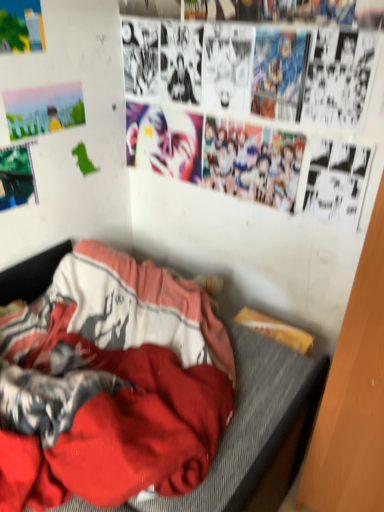
Question: From the image's perspective, is matte paper poster at upper left, the third poster page ordered from the bottom, positioned above or below watercolor paper poster at upper left, which is the second poster page in bottom-to-top order?

Choices:
 (A) below
 (B) above

Answer: (B)

Question: In terms of size, does matte paper poster at upper left, acting as the 1th poster page starting from the top, appear bigger or smaller than watercolor paper poster at upper left, which is the second poster page in bottom-to-top order?

Choices:
 (A) small
 (B) big

Answer: (B)

Question: Based on their relative distances, which object is farther from the metallic green poster at upper left, the 3th poster page when ordered from top to bottom?

Choices:
 (A) matte paper poster at upper left, the third poster page ordered from the bottom
 (B) red fabric bed at lower left
 (C) watercolor paper poster at upper left, which is the second poster page in bottom-to-top order
 (D) shiny metallic mask at upper center

Answer: (B)

Question: Which object is the closest to the metallic green poster at upper left, which ranks as the first poster page in bottom-to-top order?

Choices:
 (A) shiny metallic mask at upper center
 (B) matte paper poster at upper left, the third poster page ordered from the bottom
 (C) red fabric bed at lower left
 (D) watercolor paper poster at upper left, which is the second poster page in bottom-to-top order

Answer: (D)